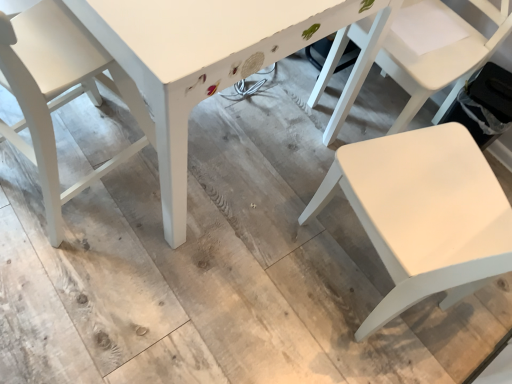
This screenshot has height=384, width=512. Find the location of `vacant space that is to the left of white matte chair at right, the 3th chair in the left-to-right sequence`. vacant space that is to the left of white matte chair at right, the 3th chair in the left-to-right sequence is located at coordinates pos(280,110).